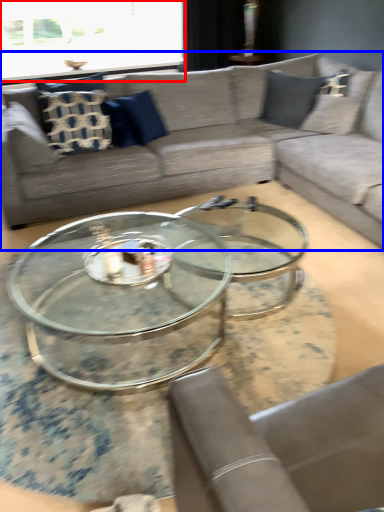
Question: Among these objects, which one is nearest to the camera, window screen (highlighted by a red box) or studio couch (highlighted by a blue box)?

Choices:
 (A) window screen
 (B) studio couch

Answer: (B)